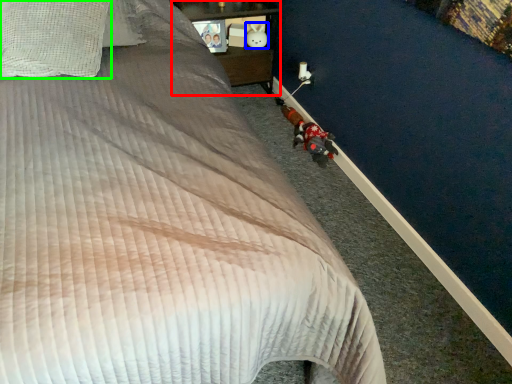
Question: Which object is the farthest from furniture (highlighted by a red box)? Choose among these: toy (highlighted by a blue box) or pillow (highlighted by a green box).

Choices:
 (A) toy
 (B) pillow

Answer: (B)